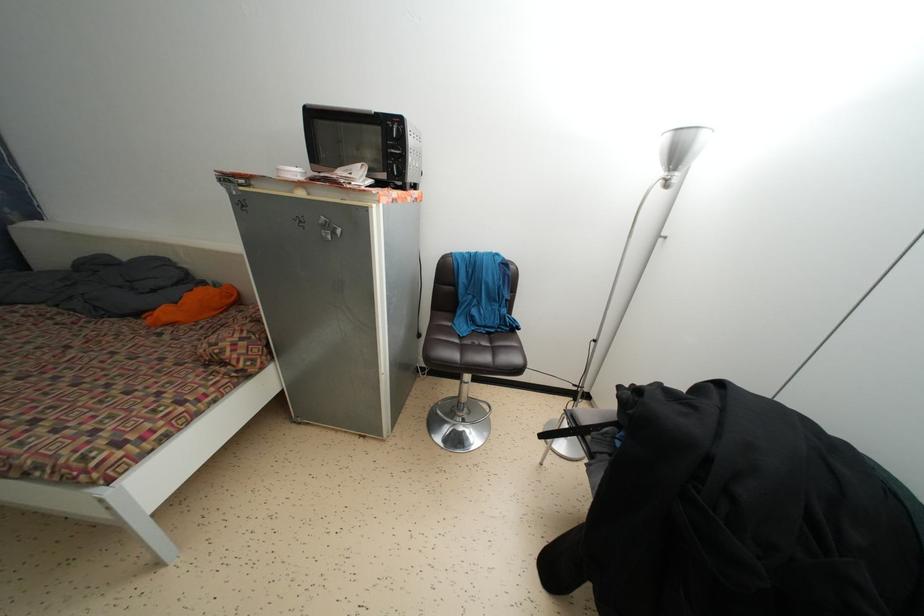
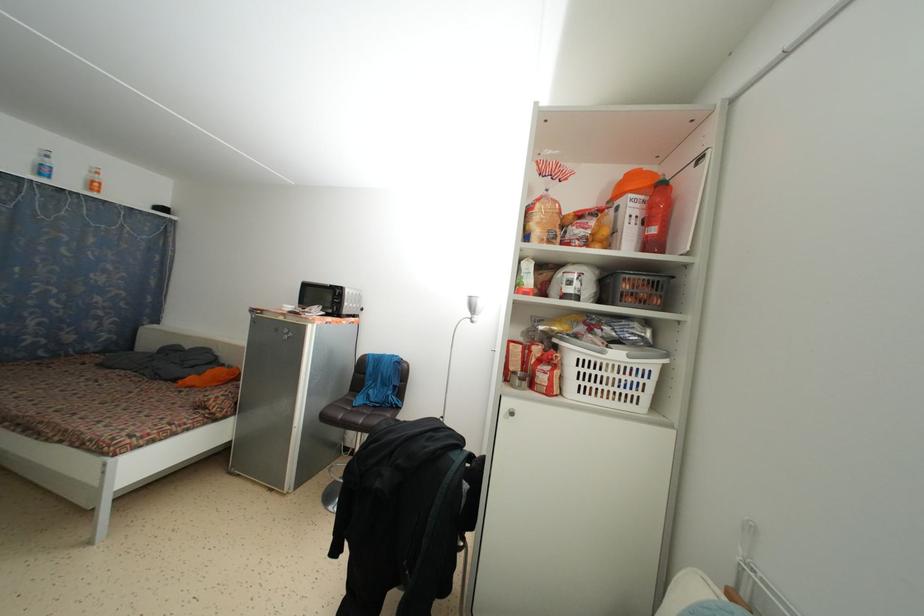
Looking at this image, the images are taken continuously from a first-person perspective. In which direction are you moving?

The movement direction of the cameraman is right, backward.